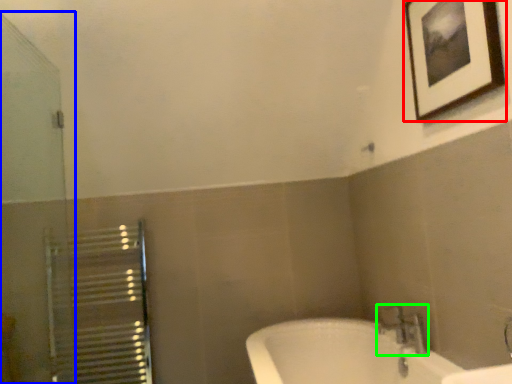
Question: Which object is the closest to the picture frame (highlighted by a red box)? Choose among these: screen door (highlighted by a blue box) or tap (highlighted by a green box).

Choices:
 (A) screen door
 (B) tap

Answer: (B)